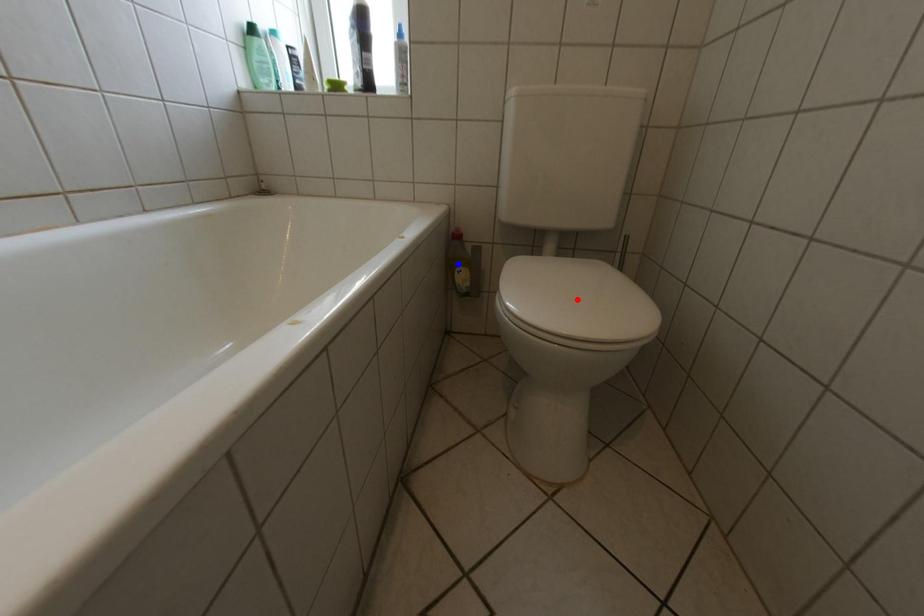
Question: Two points are marked on the image. Which point is closer to the camera?

Choices:
 (A) Blue point is closer.
 (B) Red point is closer.

Answer: (B)